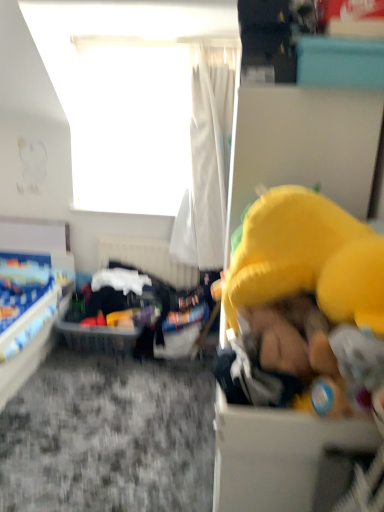
Question: Does translucent plastic basket at center have a lesser width compared to yellow plush toy at right?

Choices:
 (A) no
 (B) yes

Answer: (B)

Question: Is translucent plastic basket at center far from yellow plush toy at right?

Choices:
 (A) no
 (B) yes

Answer: (B)

Question: Is translucent plastic basket at center placed right next to yellow plush toy at right?

Choices:
 (A) yes
 (B) no

Answer: (B)

Question: Does translucent plastic basket at center have a lesser height compared to yellow plush toy at right?

Choices:
 (A) yes
 (B) no

Answer: (A)

Question: Considering the relative sizes of translucent plastic basket at center and yellow plush toy at right in the image provided, is translucent plastic basket at center wider than yellow plush toy at right?

Choices:
 (A) no
 (B) yes

Answer: (A)

Question: Is translucent plastic basket at center to the left or to the right of white sheer curtain at upper center in the image?

Choices:
 (A) right
 (B) left

Answer: (B)

Question: Is translucent plastic basket at center taller or shorter than white sheer curtain at upper center?

Choices:
 (A) tall
 (B) short

Answer: (B)

Question: Is point tap(134, 260) positioned closer to the camera than point tap(201, 121)?

Choices:
 (A) farther
 (B) closer

Answer: (A)

Question: Is translucent plastic basket at center inside the boundaries of white sheer curtain at upper center, or outside?

Choices:
 (A) inside
 (B) outside

Answer: (B)

Question: Considering the positions of blue fabric bed at lower left and transparent plastic window screen at upper center in the image, is blue fabric bed at lower left wider or thinner than transparent plastic window screen at upper center?

Choices:
 (A) wide
 (B) thin

Answer: (A)

Question: Is blue fabric bed at lower left situated inside transparent plastic window screen at upper center or outside?

Choices:
 (A) outside
 (B) inside

Answer: (A)

Question: Looking at the image, does blue fabric bed at lower left seem bigger or smaller compared to transparent plastic window screen at upper center?

Choices:
 (A) big
 (B) small

Answer: (A)

Question: Is point (4, 365) closer or farther from the camera than point (134, 131)?

Choices:
 (A) closer
 (B) farther

Answer: (A)

Question: In the image, is yellow fabric toy at right, the first box from the left, positioned in front of or behind blue fabric bed at lower left?

Choices:
 (A) behind
 (B) front

Answer: (B)

Question: Is yellow fabric toy at right, the second box from the top, bigger or smaller than blue fabric bed at lower left?

Choices:
 (A) small
 (B) big

Answer: (A)